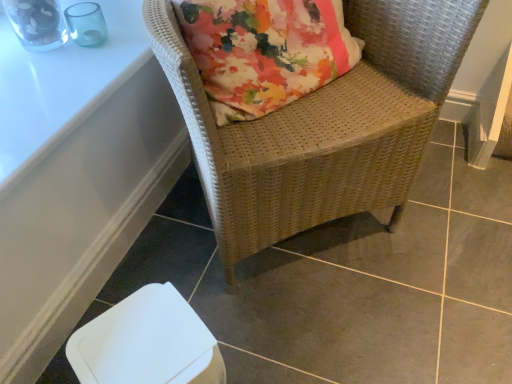
What do you see at coordinates (323, 125) in the screenshot? I see `woven wicker chair at upper right` at bounding box center [323, 125].

The width and height of the screenshot is (512, 384). What do you see at coordinates (61, 86) in the screenshot?
I see `white glossy table at upper left, arranged as the first table when viewed from the top` at bounding box center [61, 86].

What do you see at coordinates (146, 343) in the screenshot? I see `white plastic swivel chair at lower left` at bounding box center [146, 343].

The image size is (512, 384). Describe the element at coordinates (76, 177) in the screenshot. I see `white plastic table at lower left, positioned as the first table in bottom-to-top order` at that location.

Where is `woven wicker chair at upper right`? woven wicker chair at upper right is located at coordinates (323, 125).

From a real-world perspective, is white plastic swivel chair at lower left physically below white plastic table at lower left, positioned as the first table in bottom-to-top order?

Incorrect, from a real-world perspective, white plastic swivel chair at lower left is higher than white plastic table at lower left, positioned as the first table in bottom-to-top order.

Between white plastic swivel chair at lower left and white plastic table at lower left, positioned as the first table in bottom-to-top order, which one has less height?

With less height is white plastic table at lower left, positioned as the first table in bottom-to-top order.

Is white plastic swivel chair at lower left thinner than white plastic table at lower left, the 2th table when ordered from top to bottom?

No.

Which point is more forward, (127, 305) or (40, 62)?

Point (127, 305)

Which object is wider, white plastic table at lower left, positioned as the first table in bottom-to-top order, or white plastic swivel chair at lower left?

white plastic swivel chair at lower left is wider.

Based on the photo, is white plastic table at lower left, positioned as the first table in bottom-to-top order, oriented away from white plastic swivel chair at lower left?

No, white plastic table at lower left, positioned as the first table in bottom-to-top order,'s orientation is not away from white plastic swivel chair at lower left.

Considering the sizes of white plastic table at lower left, the 2th table when ordered from top to bottom, and white plastic swivel chair at lower left in the image, is white plastic table at lower left, the 2th table when ordered from top to bottom, bigger or smaller than white plastic swivel chair at lower left?

Clearly, white plastic table at lower left, the 2th table when ordered from top to bottom, is smaller in size than white plastic swivel chair at lower left.

From the image's perspective, would you say white plastic table at lower left, positioned as the first table in bottom-to-top order, is positioned over white plastic swivel chair at lower left?

Indeed, from the image's perspective, white plastic table at lower left, positioned as the first table in bottom-to-top order, is shown above white plastic swivel chair at lower left.

Looking at this image, is white glossy table at upper left, the 2th table when ordered from bottom to top, taller than white plastic swivel chair at lower left?

No.

Can you tell me how much white glossy table at upper left, the 2th table when ordered from bottom to top, and white plastic swivel chair at lower left differ in facing direction?

There is a 30-degree angle between the facing directions of white glossy table at upper left, the 2th table when ordered from bottom to top, and white plastic swivel chair at lower left.

Is white glossy table at upper left, arranged as the first table when viewed from the top, not close to white plastic swivel chair at lower left?

Actually, white glossy table at upper left, arranged as the first table when viewed from the top, and white plastic swivel chair at lower left are a little close together.

Who is more distant, white glossy table at upper left, arranged as the first table when viewed from the top, or white plastic swivel chair at lower left?

white glossy table at upper left, arranged as the first table when viewed from the top, is behind.

Are white plastic swivel chair at lower left and white glossy table at upper left, arranged as the first table when viewed from the top, making contact?

There is a gap between white plastic swivel chair at lower left and white glossy table at upper left, arranged as the first table when viewed from the top.

Which of these two, white plastic swivel chair at lower left or white glossy table at upper left, the 2th table when ordered from bottom to top, is thinner?

Thinner between the two is white plastic swivel chair at lower left.

From the picture: Is white plastic swivel chair at lower left to the left or to the right of white glossy table at upper left, the 2th table when ordered from bottom to top, in the image?

Clearly, white plastic swivel chair at lower left is on the right of white glossy table at upper left, the 2th table when ordered from bottom to top, in the image.

Does white plastic swivel chair at lower left lie behind white glossy table at upper left, arranged as the first table when viewed from the top?

No, white plastic swivel chair at lower left is closer to the viewer.

Between white plastic swivel chair at lower left and woven wicker chair at upper right, which one has more height?

woven wicker chair at upper right is taller.

How far apart are white plastic swivel chair at lower left and woven wicker chair at upper right?

A distance of 16.18 inches exists between white plastic swivel chair at lower left and woven wicker chair at upper right.

From a real-world perspective, which object stands above the other?

In real-world perspective, woven wicker chair at upper right is above.

Between white plastic swivel chair at lower left and woven wicker chair at upper right, which one has larger size?

With larger size is woven wicker chair at upper right.

Which of these two, woven wicker chair at upper right or white plastic table at lower left, positioned as the first table in bottom-to-top order, stands shorter?

With less height is white plastic table at lower left, positioned as the first table in bottom-to-top order.

Is woven wicker chair at upper right inside or outside of white plastic table at lower left, the 2th table when ordered from top to bottom?

woven wicker chair at upper right is located beyond the bounds of white plastic table at lower left, the 2th table when ordered from top to bottom.

From the image's perspective, is woven wicker chair at upper right over white plastic table at lower left, the 2th table when ordered from top to bottom?

Correct, woven wicker chair at upper right appears higher than white plastic table at lower left, the 2th table when ordered from top to bottom, in the image.

Is woven wicker chair at upper right oriented towards white plastic swivel chair at lower left?

No, woven wicker chair at upper right is not aimed at white plastic swivel chair at lower left.

Is woven wicker chair at upper right taller than white plastic swivel chair at lower left?

Yes.

Can you confirm if woven wicker chair at upper right is bigger than white plastic swivel chair at lower left?

Indeed, woven wicker chair at upper right has a larger size compared to white plastic swivel chair at lower left.

Considering the sizes of objects woven wicker chair at upper right and white plastic swivel chair at lower left in the image provided, who is thinner, woven wicker chair at upper right or white plastic swivel chair at lower left?

Thinner between the two is white plastic swivel chair at lower left.

Image resolution: width=512 pixels, height=384 pixels. In the image, there is a white plastic table at lower left, positioned as the first table in bottom-to-top order. What are the coordinates of `swivel chair below it (from the image's perspective)` in the screenshot? It's located at (146, 343).

The image size is (512, 384). I want to click on swivel chair lying on the right of white plastic table at lower left, positioned as the first table in bottom-to-top order, so click(x=146, y=343).

Based on the photo, estimate the real-world distances between objects in this image. Which object is closer to white glossy table at upper left, the 2th table when ordered from bottom to top, woven wicker chair at upper right or white plastic table at lower left, positioned as the first table in bottom-to-top order?

Among the two, white plastic table at lower left, positioned as the first table in bottom-to-top order, is located nearer to white glossy table at upper left, the 2th table when ordered from bottom to top.

From the image, which object appears to be nearer to white plastic swivel chair at lower left, white plastic table at lower left, the 2th table when ordered from top to bottom, or woven wicker chair at upper right?

Among the two, white plastic table at lower left, the 2th table when ordered from top to bottom, is located nearer to white plastic swivel chair at lower left.

Which object lies further to the anchor point white glossy table at upper left, the 2th table when ordered from bottom to top, white plastic table at lower left, the 2th table when ordered from top to bottom, or white plastic swivel chair at lower left?

white plastic swivel chair at lower left is further to white glossy table at upper left, the 2th table when ordered from bottom to top.

When comparing their distances from white glossy table at upper left, arranged as the first table when viewed from the top, does white plastic swivel chair at lower left or woven wicker chair at upper right seem further?

white plastic swivel chair at lower left.

Looking at the image, which one is located further to white plastic swivel chair at lower left, white plastic table at lower left, positioned as the first table in bottom-to-top order, or white glossy table at upper left, the 2th table when ordered from bottom to top?

Based on the image, white glossy table at upper left, the 2th table when ordered from bottom to top, appears to be further to white plastic swivel chair at lower left.

Considering their positions, is woven wicker chair at upper right positioned further to white plastic swivel chair at lower left than white glossy table at upper left, arranged as the first table when viewed from the top?

white glossy table at upper left, arranged as the first table when viewed from the top, lies further to white plastic swivel chair at lower left than the other object.

Based on the photo, when comparing their distances from white plastic swivel chair at lower left, does white glossy table at upper left, arranged as the first table when viewed from the top, or woven wicker chair at upper right seem further?

Based on the image, white glossy table at upper left, arranged as the first table when viewed from the top, appears to be further to white plastic swivel chair at lower left.

From the image, which object appears to be nearer to woven wicker chair at upper right, white glossy table at upper left, the 2th table when ordered from bottom to top, or white plastic table at lower left, the 2th table when ordered from top to bottom?

white plastic table at lower left, the 2th table when ordered from top to bottom.

At what (x,y) coordinates should I click in order to perform the action: click on table between woven wicker chair at upper right and white plastic swivel chair at lower left from top to bottom. Please return your answer as a coordinate pair (x, y). This screenshot has width=512, height=384. Looking at the image, I should click on (76, 177).

Locate an element on the screen. The width and height of the screenshot is (512, 384). chair between white glossy table at upper left, arranged as the first table when viewed from the top, and white plastic swivel chair at lower left in the up-down direction is located at coordinates (323, 125).

I want to click on table between white glossy table at upper left, arranged as the first table when viewed from the top, and white plastic swivel chair at lower left vertically, so click(76, 177).

The width and height of the screenshot is (512, 384). Identify the location of table between white glossy table at upper left, arranged as the first table when viewed from the top, and woven wicker chair at upper right from left to right. (76, 177).